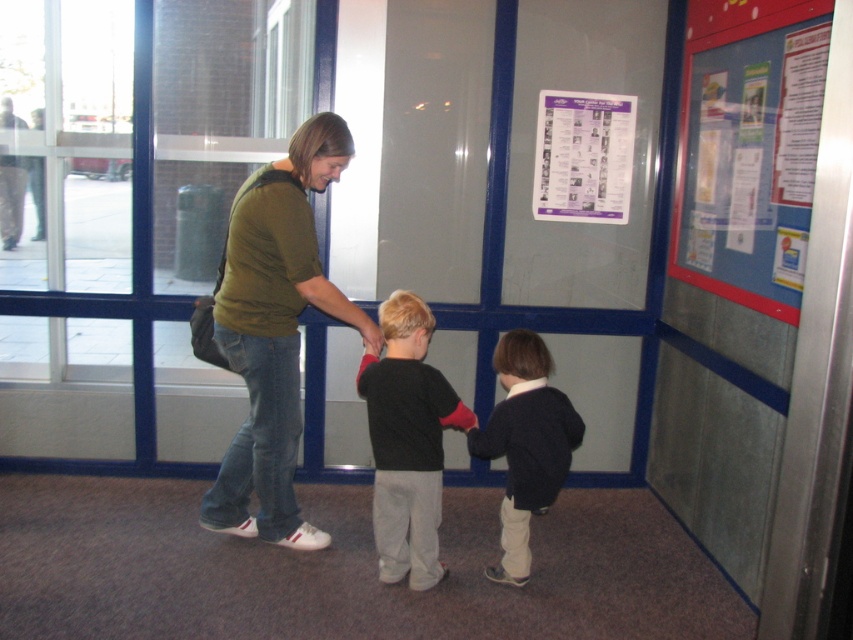
Question: Among these points, which one is farthest from the camera?

Choices:
 (A) click(x=380, y=412)
 (B) click(x=526, y=451)
 (C) click(x=773, y=170)
 (D) click(x=540, y=166)

Answer: (D)

Question: Is green cotton shirt at center positioned before dark blue sweater at center?

Choices:
 (A) yes
 (B) no

Answer: (A)

Question: Which of the following is the farthest from the observer?

Choices:
 (A) (422, 432)
 (B) (561, 161)
 (C) (250, 326)
 (D) (567, 435)

Answer: (B)

Question: Is blue fabric bulletin board at upper right in front of purple paper poster at upper center?

Choices:
 (A) yes
 (B) no

Answer: (A)

Question: Can you confirm if green cotton shirt at center is positioned to the left of black cotton shirt at center?

Choices:
 (A) no
 (B) yes

Answer: (B)

Question: Which is farther from the black cotton shirt at center?

Choices:
 (A) blue fabric bulletin board at upper right
 (B) green cotton shirt at center
 (C) purple paper poster at upper center

Answer: (A)